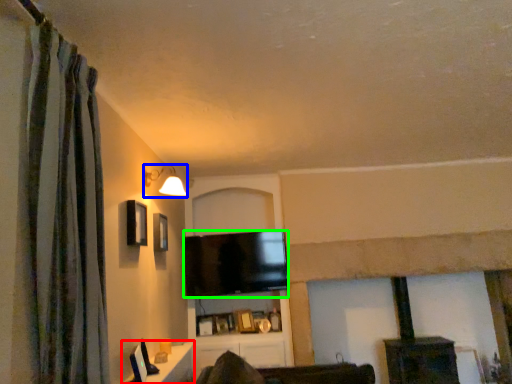
Question: Which object is the closest to the table (highlighted by a red box)? Choose among these: light fixture (highlighted by a blue box) or television (highlighted by a green box).

Choices:
 (A) light fixture
 (B) television

Answer: (B)